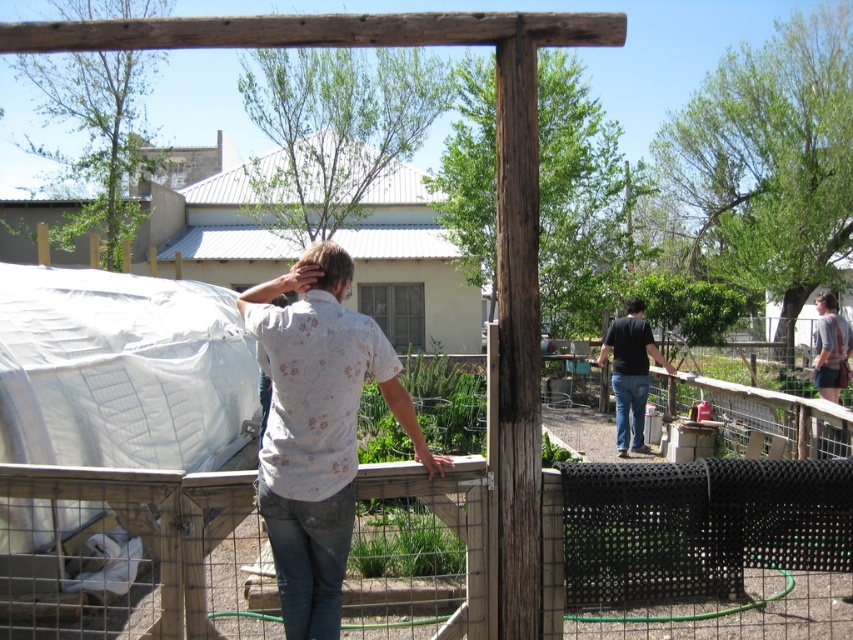
Looking at this image, you are a photographer trying to capture a portrait of the person wearing the floral shirt at center and the person wearing the black matte shirt at right. Since you want to include both subjects in the frame, should you adjust your camera angle to look upwards or downwards?

The floral shirt at center is located above the black matte shirt at right, so to include both subjects in the frame, you should adjust your camera angle to look downwards.

From the picture: You are a gardener standing at the entrance of the fenced enclosure. You need to reach both the floral shirt at center and the black matte shirt at right to deliver tools. Which shirt should you approach first if you want to minimize the distance walked?

You should approach the floral shirt at center first since it is closer to the entrance than the black matte shirt at right, which is 6.94 meters away from the floral shirt at center.

You are a photographer trying to capture a shot of both the floral shirt at center and the striped shirt at upper right. Since you can only focus on one subject at a time, which shirt should you focus on to ensure the other is still in the frame?

The floral shirt at center is to the left of striped shirt at upper right, so focusing on the floral shirt at center would keep the striped shirt at upper right within the frame as it is positioned to the right.